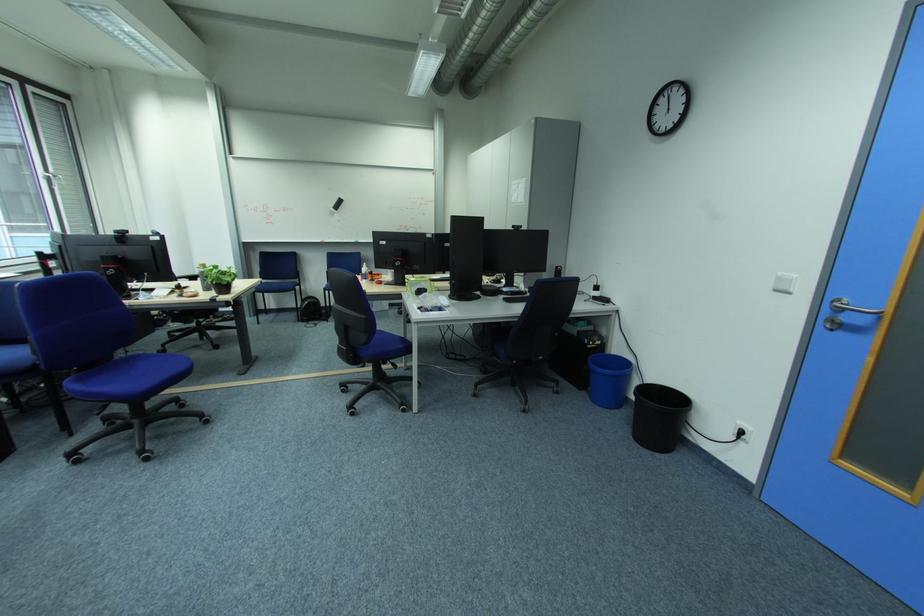
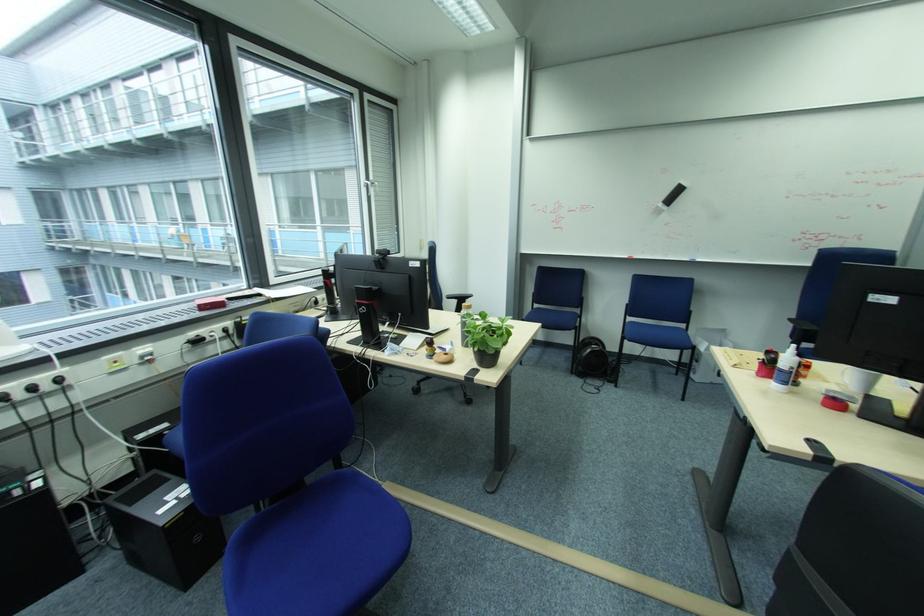
Where in the second image is the point corresponding to point (56, 177) from the first image?

(377, 184)